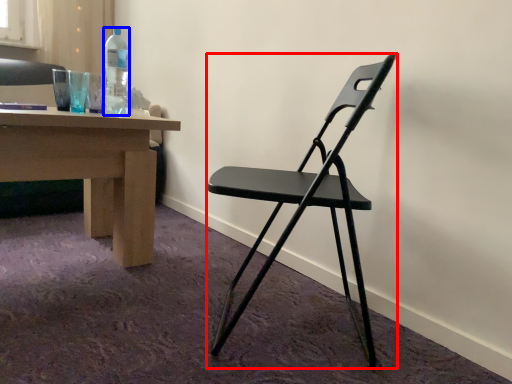
Question: Which point is closer to the camera, chair (highlighted by a red box) or bottle (highlighted by a blue box)?

Choices:
 (A) chair
 (B) bottle

Answer: (A)